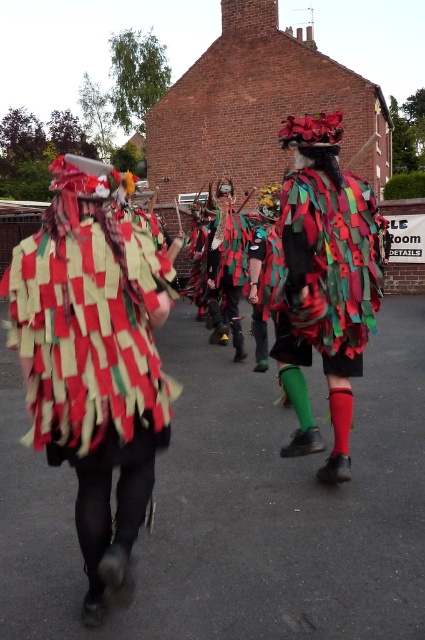
Between textured fabric cape at center and textured fabric mask at center, which one has less height?

textured fabric cape at center

Can you confirm if textured fabric cape at center is positioned to the right of textured fabric mask at center?

Correct, you'll find textured fabric cape at center to the right of textured fabric mask at center.

Is point (328, 332) closer to camera compared to point (218, 204)?

Yes, point (328, 332) is closer to viewer.

What are the coordinates of `textured fabric cape at center` in the screenshot? It's located at (328, 269).

Is point (53, 388) more distant than point (2, 282)?

Yes.

Measure the distance between textured felt costume at center and textured fabric costume at center.

textured felt costume at center and textured fabric costume at center are 1.28 meters apart from each other.

Does point (17, 316) come closer to viewer compared to point (61, 448)?

Yes, it is.

I want to click on textured felt costume at center, so click(90, 368).

The height and width of the screenshot is (640, 425). I want to click on textured felt costume at center, so click(90, 368).

Is textured felt costume at center taller than textured fabric mask at center?

Yes, textured felt costume at center is taller than textured fabric mask at center.

This screenshot has width=425, height=640. I want to click on textured felt costume at center, so click(90, 368).

I want to click on textured felt costume at center, so click(x=90, y=368).